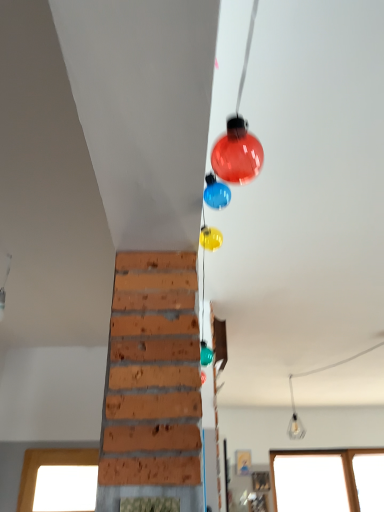
Question: Can you confirm if clear glass light bulb at center is thinner than transparent glass window at lower right?

Choices:
 (A) yes
 (B) no

Answer: (B)

Question: Does clear glass light bulb at center come in front of transparent glass window at lower right?

Choices:
 (A) no
 (B) yes

Answer: (B)

Question: Can you confirm if clear glass light bulb at center is shorter than transparent glass window at lower right?

Choices:
 (A) yes
 (B) no

Answer: (A)

Question: Could you tell me if clear glass light bulb at center is turned towards transparent glass window at lower right?

Choices:
 (A) yes
 (B) no

Answer: (B)

Question: From a real-world perspective, is clear glass light bulb at center on transparent glass window at lower right?

Choices:
 (A) no
 (B) yes

Answer: (B)

Question: Considering the relative positions of clear glass light bulb at center and transparent glass window at lower right in the image provided, is clear glass light bulb at center to the right of transparent glass window at lower right from the viewer's perspective?

Choices:
 (A) no
 (B) yes

Answer: (A)

Question: Is transparent glass window at lower right next to clear glass light bulb at center and touching it?

Choices:
 (A) yes
 (B) no

Answer: (B)

Question: Considering the relative sizes of transparent glass window at lower right and clear glass light bulb at center in the image provided, is transparent glass window at lower right thinner than clear glass light bulb at center?

Choices:
 (A) no
 (B) yes

Answer: (B)

Question: Is transparent glass window at lower right wider than clear glass light bulb at center?

Choices:
 (A) no
 (B) yes

Answer: (A)

Question: Is transparent glass window at lower right oriented away from clear glass light bulb at center?

Choices:
 (A) yes
 (B) no

Answer: (B)

Question: Is transparent glass window at lower right closer to the viewer compared to clear glass light bulb at center?

Choices:
 (A) no
 (B) yes

Answer: (A)

Question: Is transparent glass window at lower right bigger than clear glass light bulb at center?

Choices:
 (A) yes
 (B) no

Answer: (A)

Question: Is clear glass light bulb at center in front of or behind transparent glass window at lower right in the image?

Choices:
 (A) front
 (B) behind

Answer: (A)